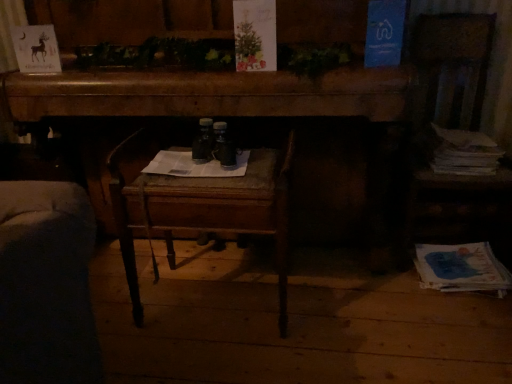
The width and height of the screenshot is (512, 384). In order to click on free space in front of wooden chair at center in this screenshot , I will do `click(205, 359)`.